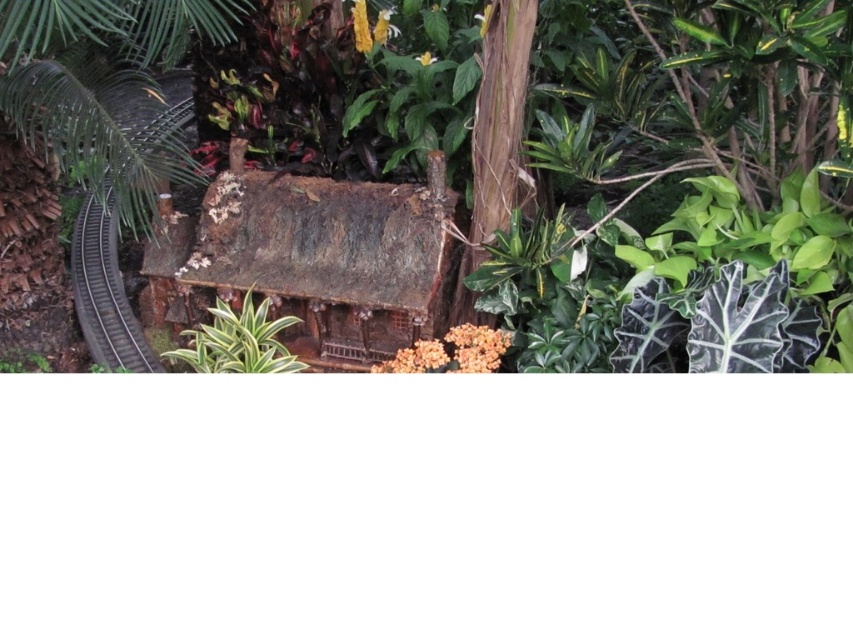
Can you confirm if rusty wood house at center is positioned to the left of black metal train track at left?

In fact, rusty wood house at center is to the right of black metal train track at left.

Can you confirm if rusty wood house at center is smaller than black metal train track at left?

Incorrect, rusty wood house at center is not smaller in size than black metal train track at left.

Who is more distant from viewer, (665, 108) or (107, 307)?

The point (107, 307) is behind.

Where is `rusty wood house at center`? The height and width of the screenshot is (640, 853). rusty wood house at center is located at coordinates (708, 90).

Does brown rough bark tree at center appear on the right side of black metal train track at left?

Yes, brown rough bark tree at center is to the right of black metal train track at left.

Does point (462, 268) lie in front of point (171, 93)?

Yes, point (462, 268) is closer to viewer.

Measure the distance between point (500,65) and camera.

They are 2.28 meters apart.

You are a GUI agent. You are given a task and a screenshot of the screen. Output one action in this format:
    pyautogui.click(x=<x>, y=<y>)
    Task: Click on the brown rough bark tree at center
    This screenshot has height=640, width=853.
    Given the screenshot: What is the action you would take?
    pyautogui.click(x=496, y=136)

Which is behind, point (310, 292) or point (108, 332)?

The point (108, 332) is behind.

Does rusty wood hut at center have a smaller size compared to black metal train track at left?

Actually, rusty wood hut at center might be larger than black metal train track at left.

Locate an element on the screen. The width and height of the screenshot is (853, 640). rusty wood hut at center is located at coordinates (318, 260).

The height and width of the screenshot is (640, 853). I want to click on rusty wood hut at center, so click(318, 260).